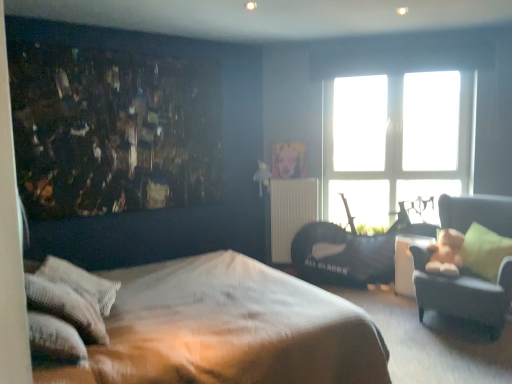
Question: Relative to transparent glass window at upper center, is white textured pillow at lower left, the 2th pillow viewed from the front, in front or behind?

Choices:
 (A) front
 (B) behind

Answer: (A)

Question: From a real-world perspective, relative to transparent glass window at upper center, is white textured pillow at lower left, the 2th pillow viewed from the front, vertically above or below?

Choices:
 (A) above
 (B) below

Answer: (B)

Question: Which object is the farthest from the black leather swivel chair at right?

Choices:
 (A) green fabric pillow at right, marked as the third pillow in a left-to-right arrangement
 (B) white textured pillow at lower left, which ranks as the 3th pillow in back-to-front order
 (C) transparent glass window at upper center
 (D) white textured pillow at lower left, the 2th pillow viewed from the front
 (E) white glossy table at right

Answer: (B)

Question: Which object is positioned farthest from the metallic gold radiator at center?

Choices:
 (A) brown textured bed at center
 (B) green fabric pillow at right, marked as the third pillow in a left-to-right arrangement
 (C) white glossy table at right
 (D) black leather swivel chair at right
 (E) transparent glass window at upper center

Answer: (A)